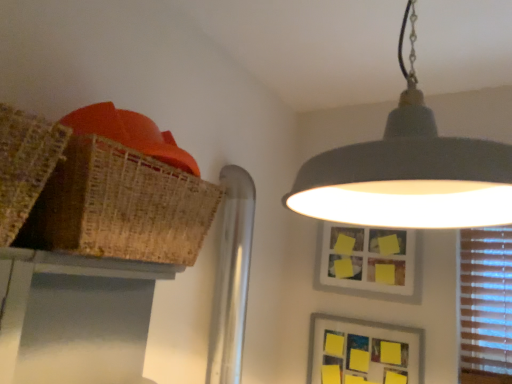
Question: Can you confirm if braided wicker basket at upper left is smaller than yellow matte picture frame at upper center, the 1th picture frame from the top?

Choices:
 (A) yes
 (B) no

Answer: (B)

Question: Is braided wicker basket at upper left placed right next to yellow matte picture frame at upper center, marked as the 2th picture frame in a bottom-to-top arrangement?

Choices:
 (A) yes
 (B) no

Answer: (B)

Question: Does braided wicker basket at upper left have a greater width compared to yellow matte picture frame at upper center, marked as the 2th picture frame in a bottom-to-top arrangement?

Choices:
 (A) yes
 (B) no

Answer: (A)

Question: Is braided wicker basket at upper left closer to camera compared to yellow matte picture frame at upper center, the 1th picture frame from the top?

Choices:
 (A) yes
 (B) no

Answer: (A)

Question: From a real-world perspective, is braided wicker basket at upper left positioned over yellow matte picture frame at upper center, the 1th picture frame from the top, based on gravity?

Choices:
 (A) no
 (B) yes

Answer: (B)

Question: Is yellow matte picture frame at upper center, marked as the 2th picture frame in a bottom-to-top arrangement, at the back of braided wicker basket at upper left?

Choices:
 (A) yes
 (B) no

Answer: (B)

Question: Considering the relative sizes of yellow matte picture frame at upper center, the 1th picture frame from the top, and matte gray lampshade at upper center in the image provided, is yellow matte picture frame at upper center, the 1th picture frame from the top, smaller than matte gray lampshade at upper center?

Choices:
 (A) yes
 (B) no

Answer: (A)

Question: Is yellow matte picture frame at upper center, the 1th picture frame from the top, directly adjacent to matte gray lampshade at upper center?

Choices:
 (A) yes
 (B) no

Answer: (B)

Question: Is yellow matte picture frame at upper center, the 1th picture frame from the top, positioned behind matte gray lampshade at upper center?

Choices:
 (A) no
 (B) yes

Answer: (B)

Question: Is the position of yellow matte picture frame at upper center, the 1th picture frame from the top, less distant than that of matte gray lampshade at upper center?

Choices:
 (A) yes
 (B) no

Answer: (B)

Question: Is yellow matte picture frame at upper center, marked as the 2th picture frame in a bottom-to-top arrangement, positioned far away from matte gray lampshade at upper center?

Choices:
 (A) yes
 (B) no

Answer: (B)

Question: From the image's perspective, is yellow matte picture frame at upper center, the 1th picture frame from the top, above matte gray lampshade at upper center?

Choices:
 (A) yes
 (B) no

Answer: (B)

Question: Could you tell me if bamboo table at upper left is facing matte gray lampshade at upper center?

Choices:
 (A) no
 (B) yes

Answer: (A)